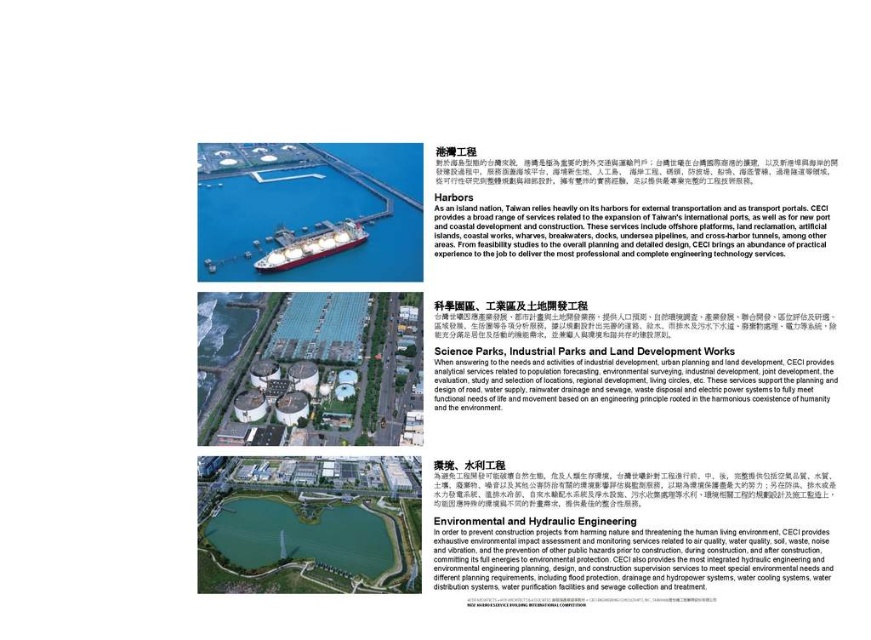
Which is more to the left, white paper at center or red glossy ship at center?

Positioned to the left is red glossy ship at center.

Can you confirm if white paper at center is taller than red glossy ship at center?

No, white paper at center is not taller than red glossy ship at center.

Is point (788, 356) positioned in front of point (302, 244)?

Yes, point (788, 356) is in front of point (302, 244).

Locate an element on the screen. The height and width of the screenshot is (640, 871). white paper at center is located at coordinates (620, 376).

Does white matte ship at upper center have a larger size compared to red glossy ship at center?

Incorrect, white matte ship at upper center is not larger than red glossy ship at center.

This screenshot has height=640, width=871. What do you see at coordinates (626, 228) in the screenshot? I see `white matte ship at upper center` at bounding box center [626, 228].

Which is in front, point (483, 211) or point (356, 224)?

Point (483, 211) is in front.

Locate an element on the screen. This screenshot has height=640, width=871. white matte ship at upper center is located at coordinates (626, 228).

Is white matte ship at upper center positioned in front of green concrete waterway at center?

Yes, white matte ship at upper center is closer to the viewer.

How far apart are white matte ship at upper center and green concrete waterway at center?

A distance of 383.19 feet exists between white matte ship at upper center and green concrete waterway at center.

Find the location of a particular element. white matte ship at upper center is located at coordinates (626, 228).